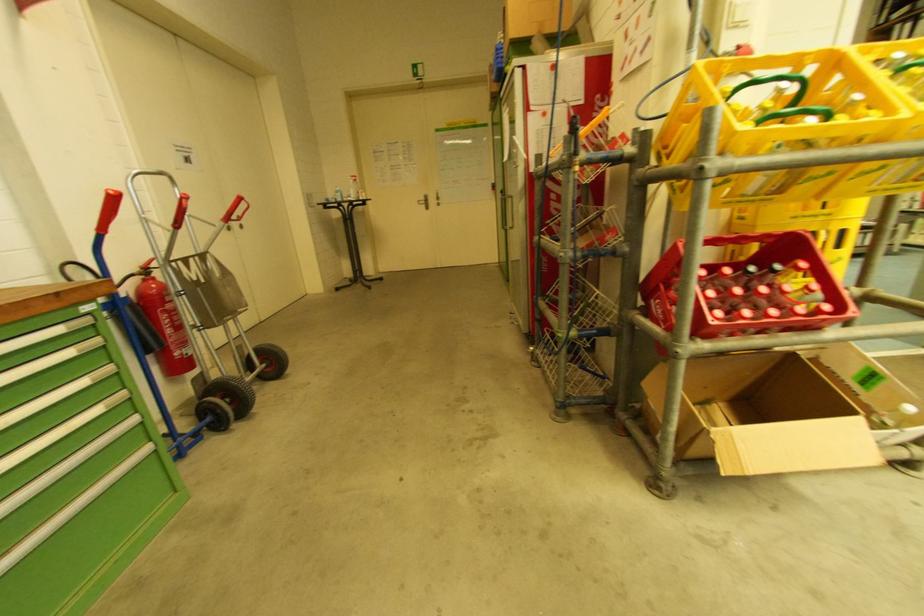
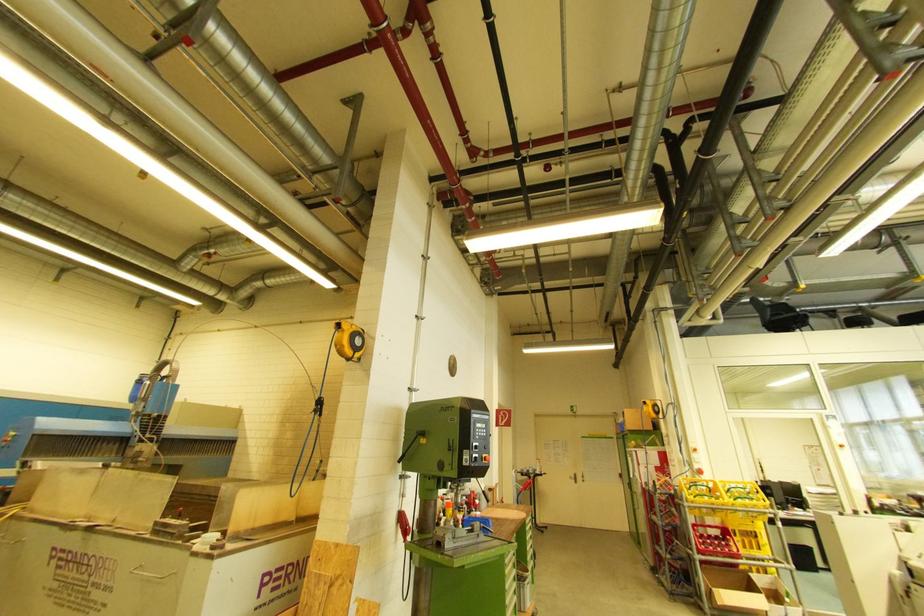
Locate, in the second image, the point that corresponds to point 424,201 in the first image.

(575, 477)